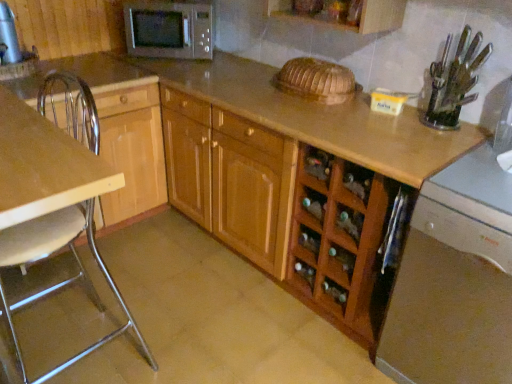
Question: Would you say clear plastic knife block at upper right, the second appliance when ordered from back to front, contains wooden cabinet at left, the 1th cabinetry positioned from the left?

Choices:
 (A) no
 (B) yes

Answer: (A)

Question: Is clear plastic knife block at upper right, the second appliance when ordered from back to front, closer to camera compared to wooden cabinet at left, positioned as the second cabinetry in right-to-left order?

Choices:
 (A) yes
 (B) no

Answer: (A)

Question: Can you confirm if clear plastic knife block at upper right, the 2th appliance in the top-to-bottom sequence, is positioned to the left of wooden cabinet at left, the 1th cabinetry positioned from the left?

Choices:
 (A) yes
 (B) no

Answer: (B)

Question: Does clear plastic knife block at upper right, the first appliance in the right-to-left sequence, have a lesser width compared to wooden cabinet at left, the 1th cabinetry positioned from the left?

Choices:
 (A) no
 (B) yes

Answer: (B)

Question: Is wooden cabinet at left, positioned as the second cabinetry in right-to-left order, at the back of clear plastic knife block at upper right, the first appliance in the right-to-left sequence?

Choices:
 (A) no
 (B) yes

Answer: (A)

Question: From their relative heights in the image, would you say satin silver microwave at upper center is taller or shorter than wooden cabinet at left, the 1th cabinetry positioned from the left?

Choices:
 (A) tall
 (B) short

Answer: (B)

Question: In the image, is satin silver microwave at upper center positioned in front of or behind wooden cabinet at left, the 1th cabinetry positioned from the left?

Choices:
 (A) front
 (B) behind

Answer: (B)

Question: Considering the positions of satin silver microwave at upper center and wooden cabinet at left, positioned as the second cabinetry in right-to-left order, in the image, is satin silver microwave at upper center wider or thinner than wooden cabinet at left, positioned as the second cabinetry in right-to-left order,?

Choices:
 (A) thin
 (B) wide

Answer: (A)

Question: Is point (136, 36) positioned closer to the camera than point (57, 100)?

Choices:
 (A) farther
 (B) closer

Answer: (A)

Question: From a real-world perspective, relative to satin silver dishwasher at lower right, is brushed metal water heater at upper left, the first appliance positioned from the top, vertically above or below?

Choices:
 (A) above
 (B) below

Answer: (A)

Question: From the image's perspective, is brushed metal water heater at upper left, acting as the second appliance starting from the right, positioned above or below satin silver dishwasher at lower right?

Choices:
 (A) below
 (B) above

Answer: (B)

Question: In terms of width, does brushed metal water heater at upper left, the 1th appliance when ordered from back to front, look wider or thinner when compared to satin silver dishwasher at lower right?

Choices:
 (A) thin
 (B) wide

Answer: (A)

Question: Is brushed metal water heater at upper left, which is the second appliance in front-to-back order, taller or shorter than satin silver dishwasher at lower right?

Choices:
 (A) short
 (B) tall

Answer: (A)

Question: Is clear plastic knife block at upper right, the first appliance in the right-to-left sequence, in front of or behind satin silver microwave at upper center in the image?

Choices:
 (A) behind
 (B) front

Answer: (B)

Question: Looking at the image, does clear plastic knife block at upper right, which is the first appliance in front-to-back order, seem bigger or smaller compared to satin silver microwave at upper center?

Choices:
 (A) big
 (B) small

Answer: (B)